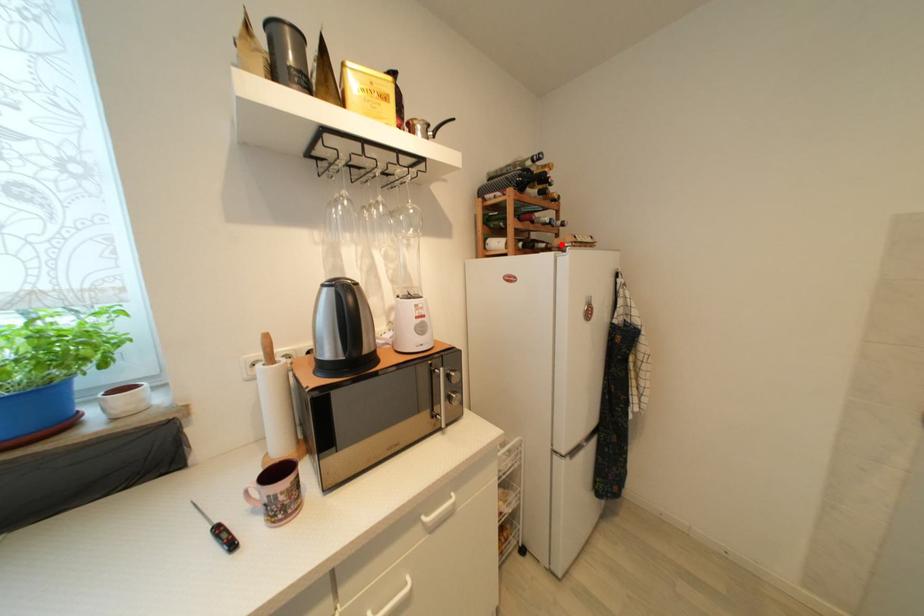
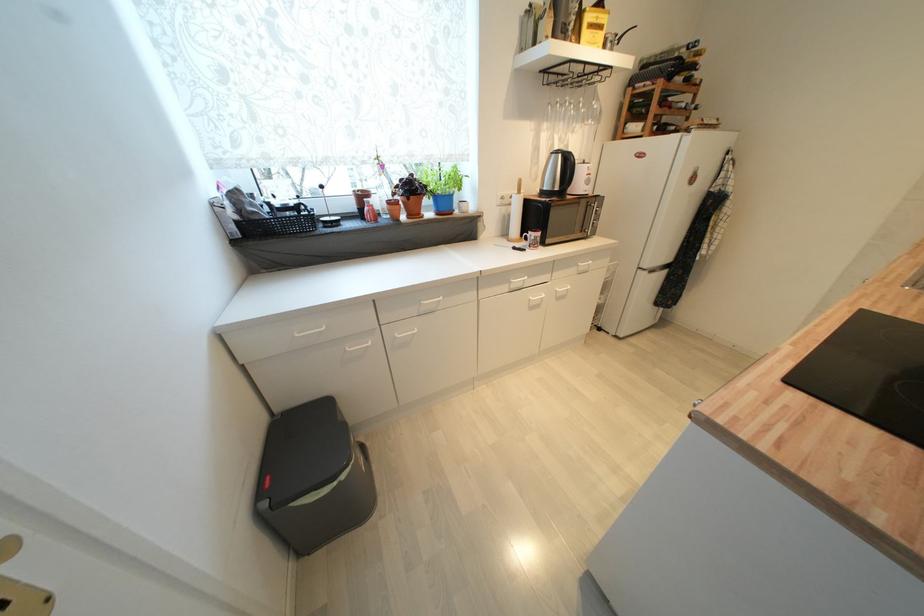
In the second image, find the point that corresponds to the highlighted location in the first image.

(690, 127)